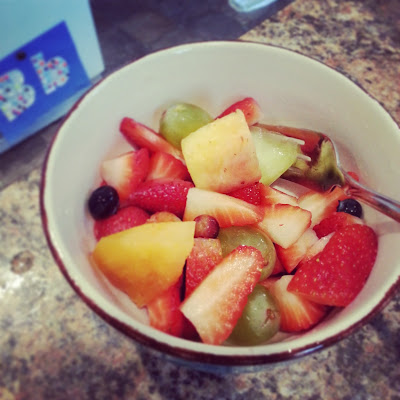
This screenshot has width=400, height=400. I want to click on fork, so click(x=332, y=171).